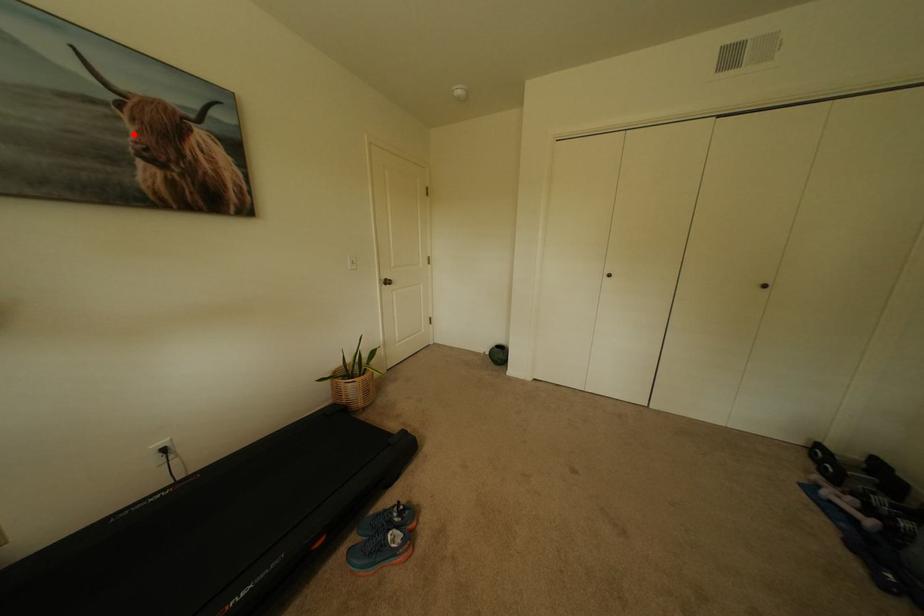
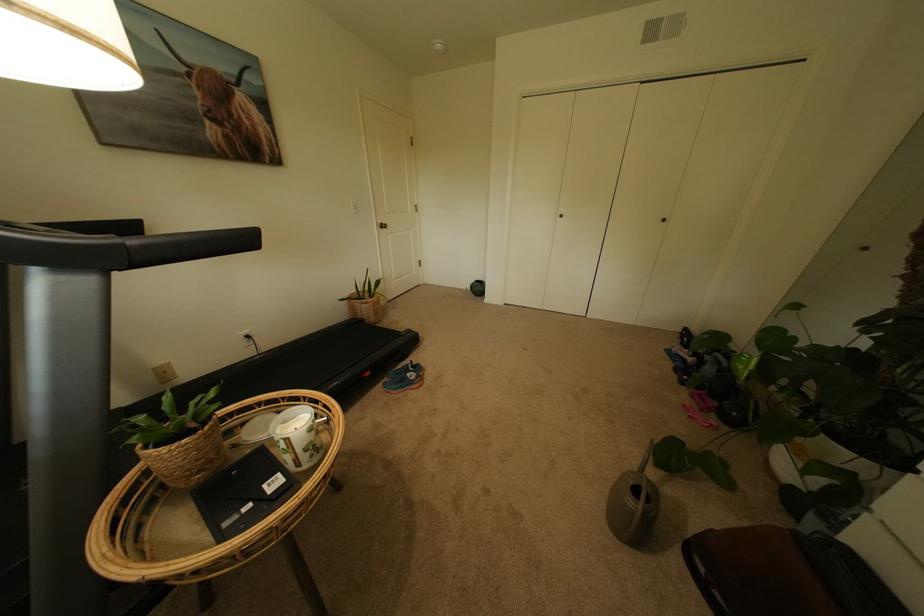
The point at the highlighted location is marked in the first image. Where is the corresponding point in the second image?

(204, 100)